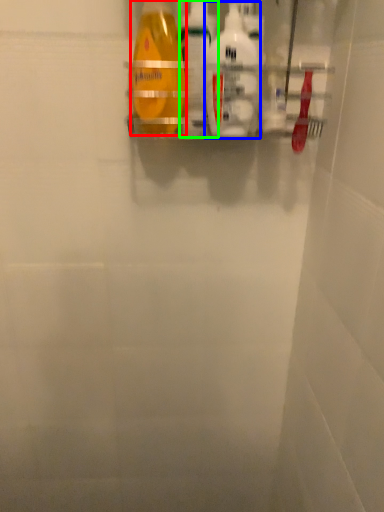
Question: Considering the real-world distances, which object is farthest from bottle (highlighted by a red box)? cleaning product (highlighted by a blue box) or cleaning product (highlighted by a green box)?

Choices:
 (A) cleaning product
 (B) cleaning product

Answer: (A)